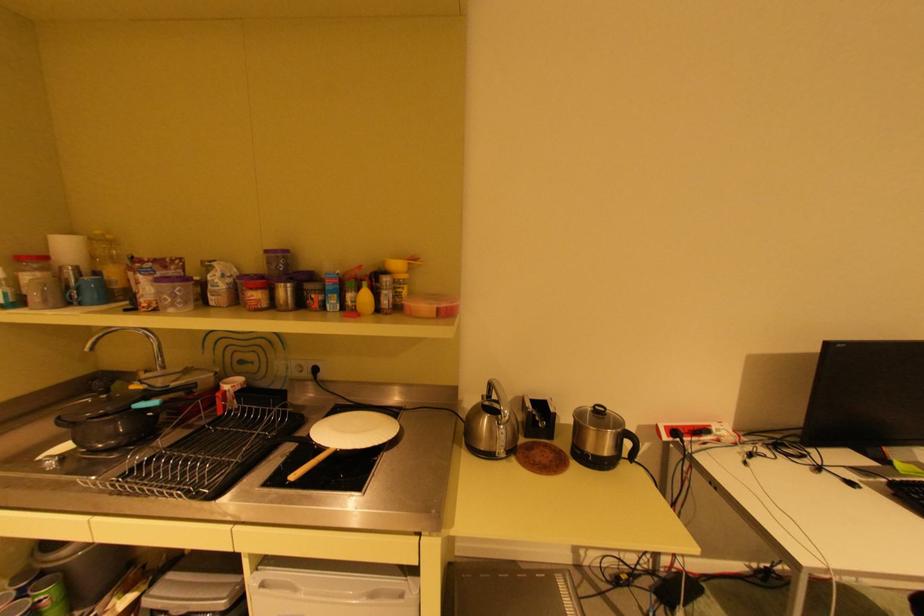
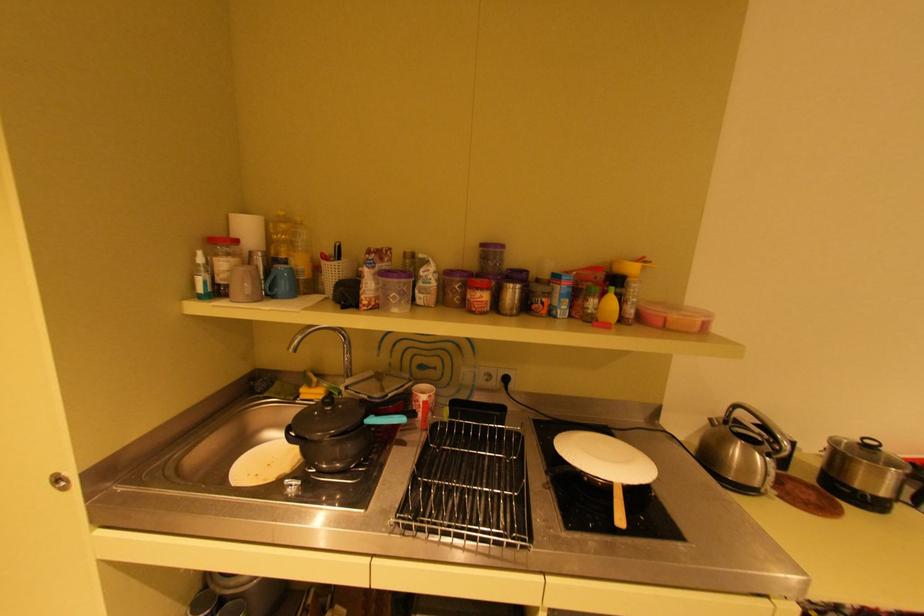
Find the pixel in the second image that matches (x=139, y=408) in the first image.

(371, 424)